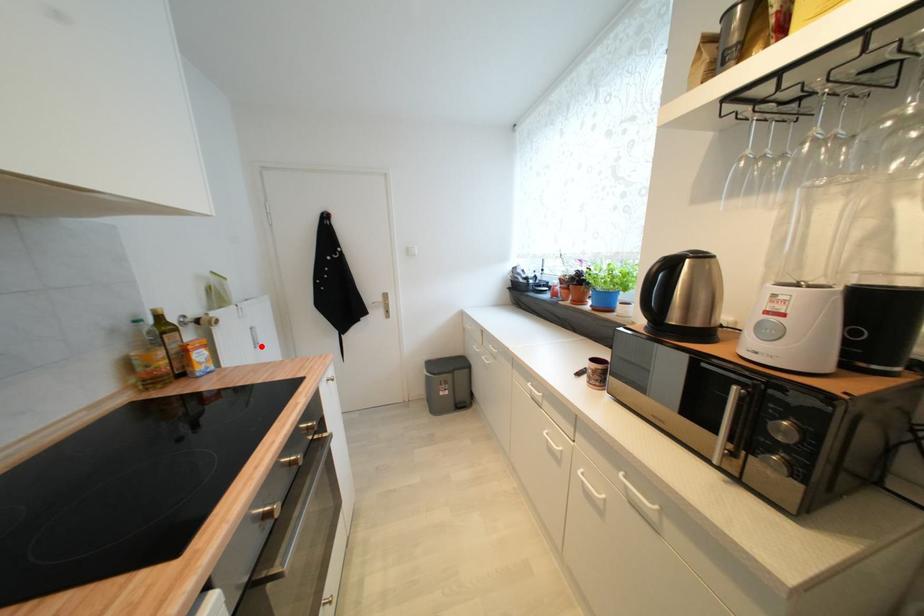
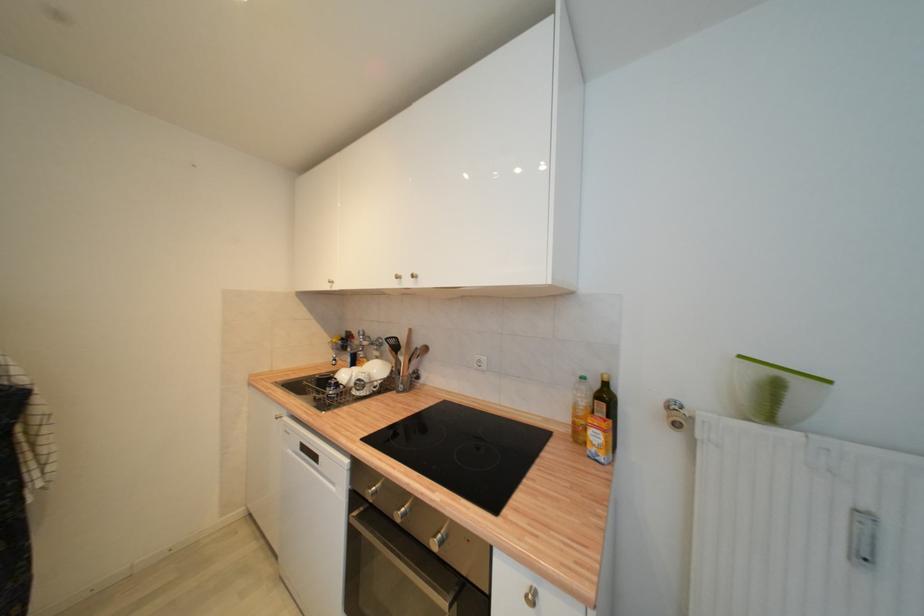
Question: I am providing you with two images of the same scene from different viewpoints. Given a red point in image1, look at the same physical point in image2. Is it:

Choices:
 (A) Closer to the viewpoint
 (B) Farther from the viewpoint

Answer: (B)